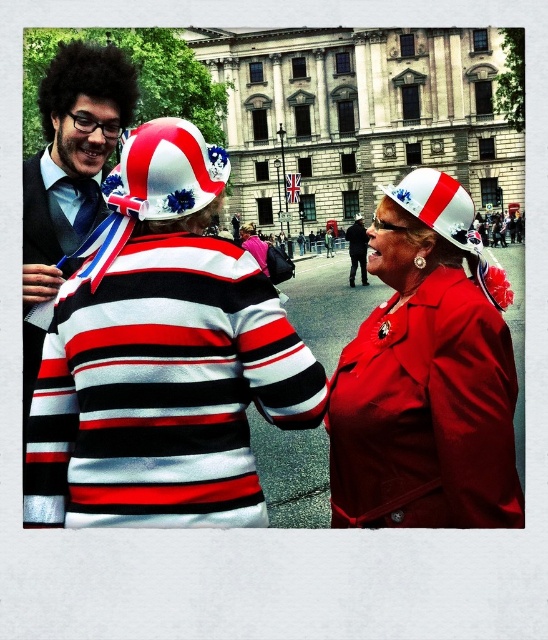
Does white and red striped hat with floral decorations at center have a greater height compared to white fabric hat at upper center?

Correct, white and red striped hat with floral decorations at center is much taller as white fabric hat at upper center.

Which is more to the right, white and red striped hat with floral decorations at center or white fabric hat at upper center?

white fabric hat at upper center

This screenshot has height=640, width=548. I want to click on white and red striped hat with floral decorations at center, so click(x=165, y=172).

You are a GUI agent. You are given a task and a screenshot of the screen. Output one action in this format:
    pyautogui.click(x=<x>, y=<y>)
    Task: Click on the white and red striped hat with floral decorations at center
    The width and height of the screenshot is (548, 640).
    Given the screenshot: What is the action you would take?
    pyautogui.click(x=165, y=172)

Is point (61, 356) less distant than point (250, 225)?

Yes, it is in front of point (250, 225).

The height and width of the screenshot is (640, 548). I want to click on matte fabric hat at upper center, so click(x=162, y=356).

Between point (60, 522) and point (244, 241), which one is positioned in front?

Point (60, 522) is more forward.

You are a GUI agent. You are given a task and a screenshot of the screen. Output one action in this format:
    pyautogui.click(x=<x>, y=<y>)
    Task: Click on the matte fabric hat at upper center
    The height and width of the screenshot is (640, 548).
    Given the screenshot: What is the action you would take?
    pyautogui.click(x=162, y=356)

Is the position of white and red fabric hat at center more distant than that of white fabric hat at upper center?

No, it is not.

Describe the element at coordinates (438, 205) in the screenshot. I see `white and red fabric hat at center` at that location.

Who is more distant from viewer, (444, 180) or (358, 216)?

The point (358, 216) is behind.

Where is `white and red fabric hat at center`? white and red fabric hat at center is located at coordinates (438, 205).